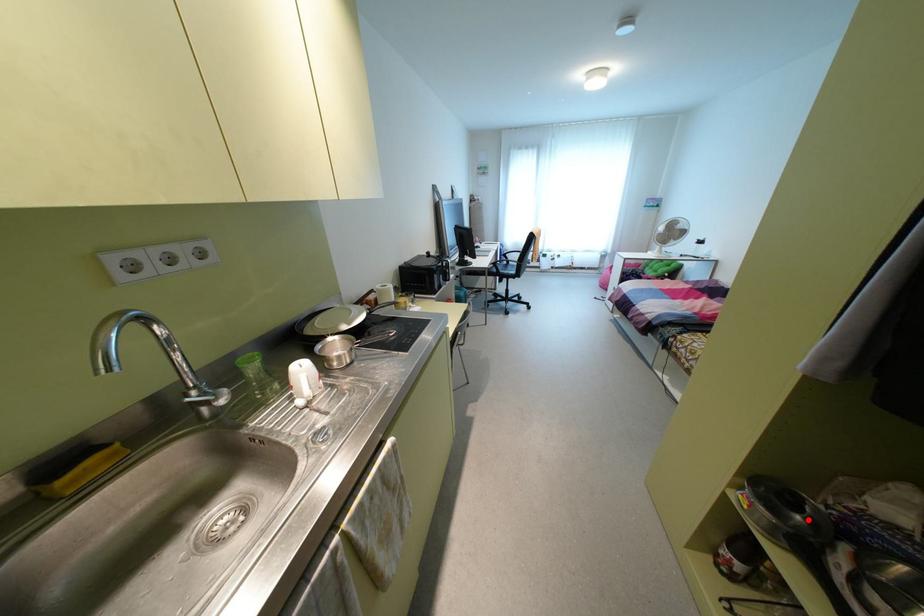
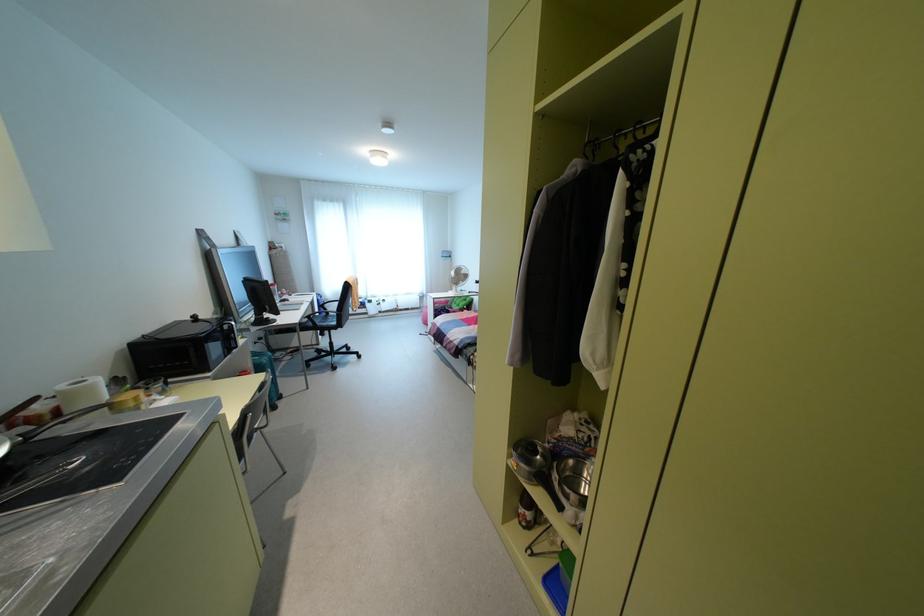
The point at the highlighted location is marked in the first image. Where is the corresponding point in the second image?

(541, 456)